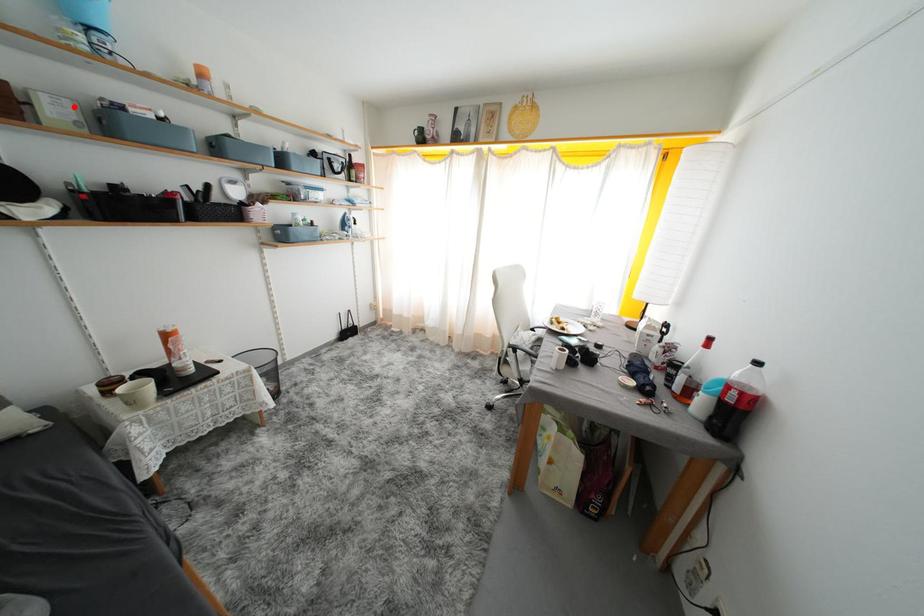
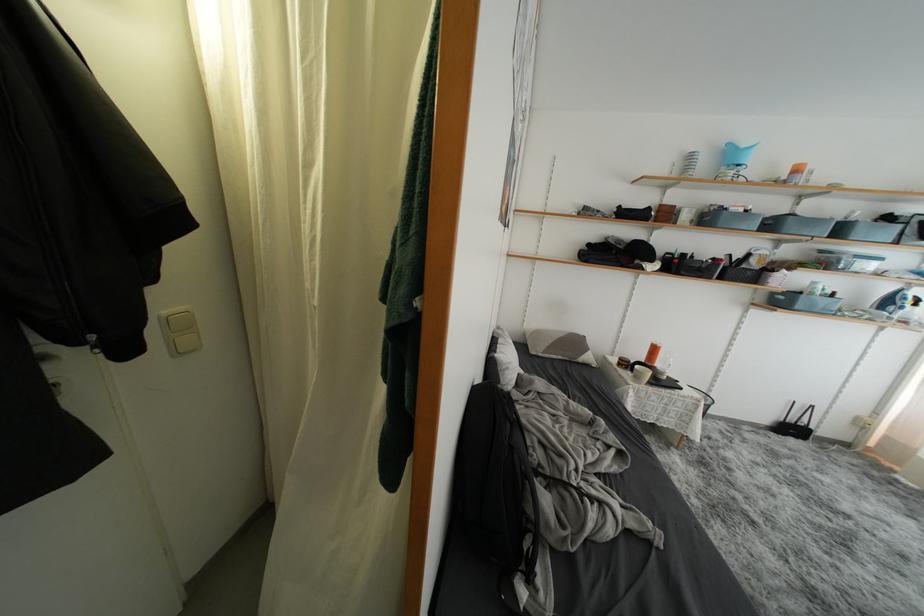
The point at the highlighted location is marked in the first image. Where is the corresponding point in the second image?

(700, 215)